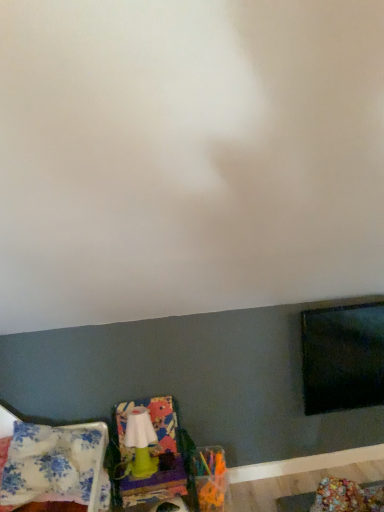
Question: Is the surface of floral fabric pillow at lower left in direct contact with green plastic swivel chair at lower left?

Choices:
 (A) no
 (B) yes

Answer: (A)

Question: Is floral fabric pillow at lower left bigger than green plastic swivel chair at lower left?

Choices:
 (A) yes
 (B) no

Answer: (B)

Question: Does floral fabric pillow at lower left have a lesser height compared to green plastic swivel chair at lower left?

Choices:
 (A) no
 (B) yes

Answer: (B)

Question: Does floral fabric pillow at lower left have a greater height compared to green plastic swivel chair at lower left?

Choices:
 (A) no
 (B) yes

Answer: (A)

Question: From a real-world perspective, is floral fabric pillow at lower left below green plastic swivel chair at lower left?

Choices:
 (A) yes
 (B) no

Answer: (B)

Question: From the image's perspective, is floral fabric pillow at lower left above green plastic swivel chair at lower left?

Choices:
 (A) no
 (B) yes

Answer: (B)

Question: Considering the relative positions of green plastic swivel chair at lower left and green matte lamp at lower left in the image provided, is green plastic swivel chair at lower left in front of green matte lamp at lower left?

Choices:
 (A) no
 (B) yes

Answer: (B)

Question: Can you confirm if green plastic swivel chair at lower left is bigger than green matte lamp at lower left?

Choices:
 (A) yes
 (B) no

Answer: (A)

Question: Considering the relative sizes of green plastic swivel chair at lower left and green matte lamp at lower left in the image provided, is green plastic swivel chair at lower left wider than green matte lamp at lower left?

Choices:
 (A) no
 (B) yes

Answer: (B)

Question: Is green plastic swivel chair at lower left taller than green matte lamp at lower left?

Choices:
 (A) no
 (B) yes

Answer: (B)

Question: Is green plastic swivel chair at lower left shorter than green matte lamp at lower left?

Choices:
 (A) yes
 (B) no

Answer: (B)

Question: Does green plastic swivel chair at lower left touch green matte lamp at lower left?

Choices:
 (A) no
 (B) yes

Answer: (B)

Question: Considering the relative positions of green plastic swivel chair at lower left and floral fabric pillow at lower left in the image provided, is green plastic swivel chair at lower left in front of floral fabric pillow at lower left?

Choices:
 (A) yes
 (B) no

Answer: (B)